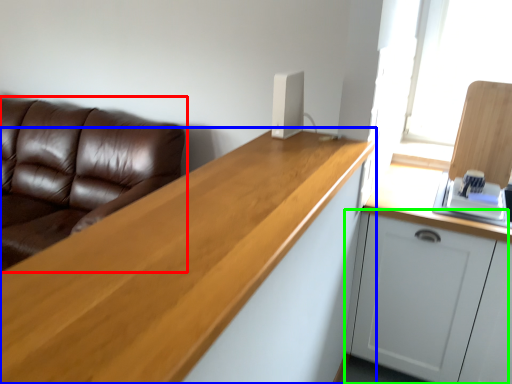
Question: Based on their relative distances, which object is nearer to studio couch (highlighted by a red box)? Choose from countertop (highlighted by a blue box) and cabinetry (highlighted by a green box).

Choices:
 (A) countertop
 (B) cabinetry

Answer: (A)